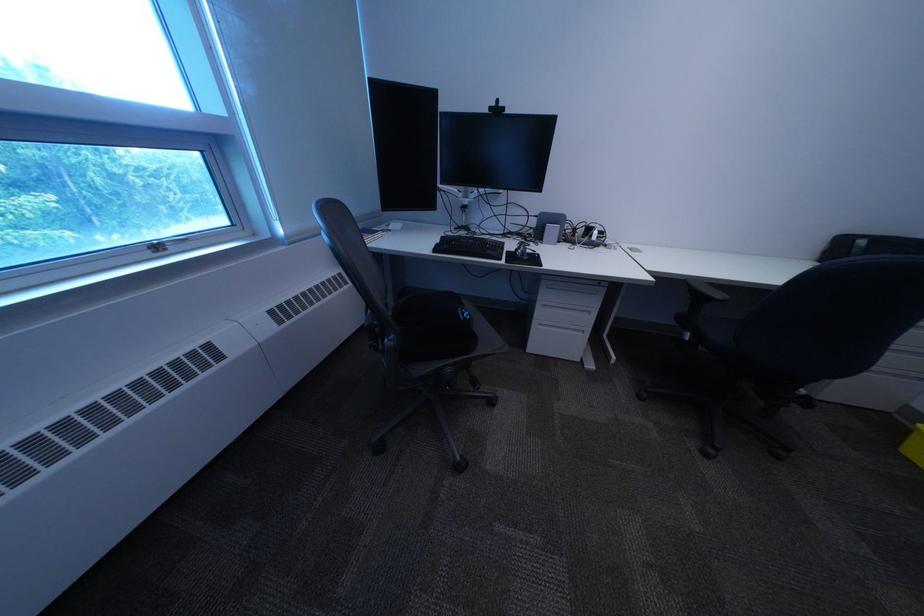
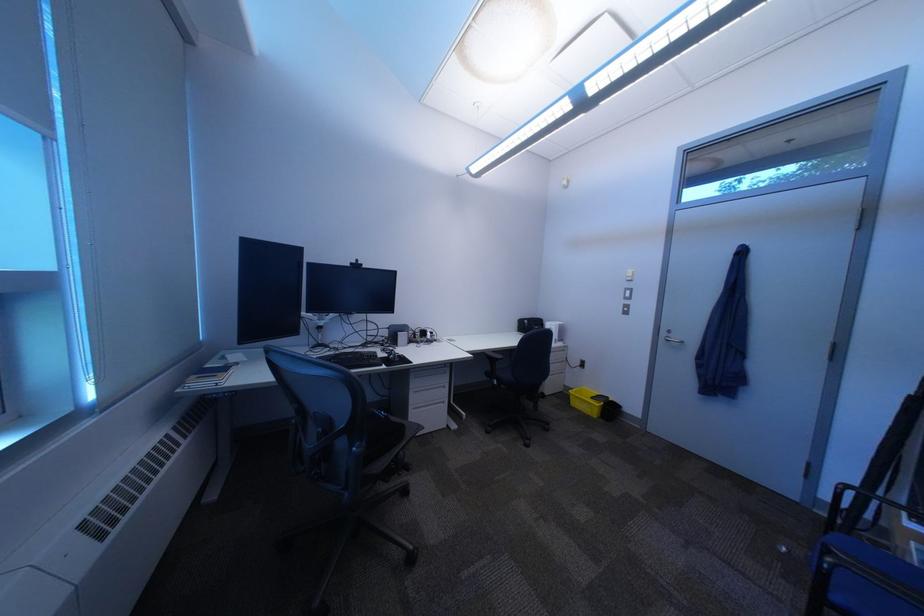
Question: The camera is either moving clockwise (left) or counter-clockwise (right) around the object. The first image is from the beginning of the video and the second image is from the end. Is the camera moving left or right when shooting the video?

Choices:
 (A) Left
 (B) Right

Answer: (A)